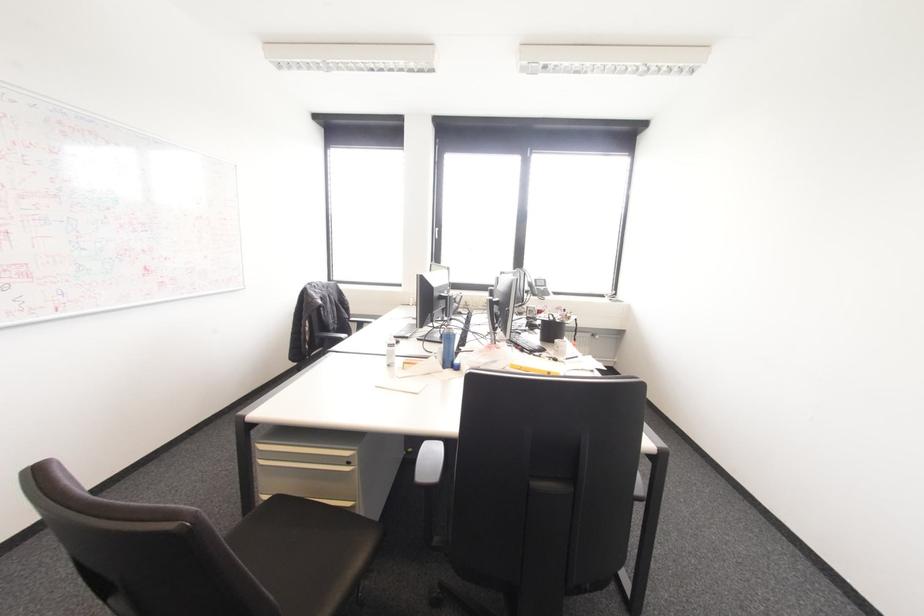
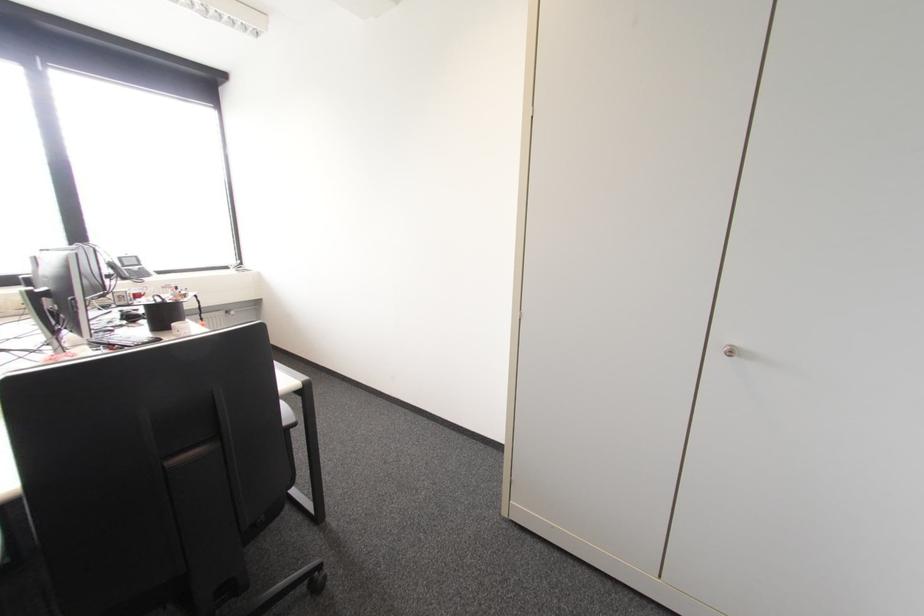
Locate, in the second image, the point that corresponds to (542,321) in the first image.

(148, 306)